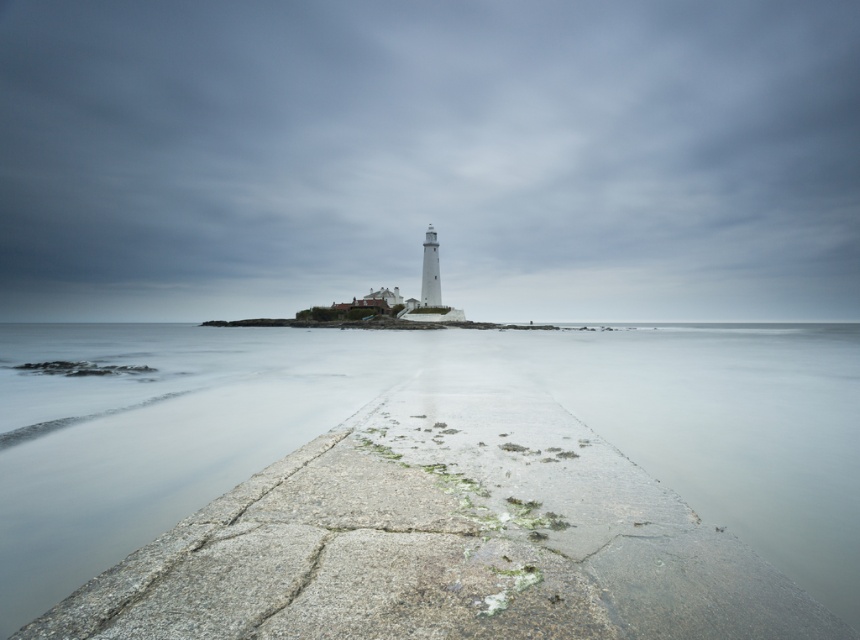
Does white concrete lighthouse at center have a larger size compared to clear water at center?

Correct, white concrete lighthouse at center is larger in size than clear water at center.

Which is below, white concrete lighthouse at center or clear water at center?

clear water at center is lower down.

The height and width of the screenshot is (640, 860). What do you see at coordinates (430, 157) in the screenshot?
I see `white concrete lighthouse at center` at bounding box center [430, 157].

Where is `white concrete lighthouse at center`? The height and width of the screenshot is (640, 860). white concrete lighthouse at center is located at coordinates (430, 157).